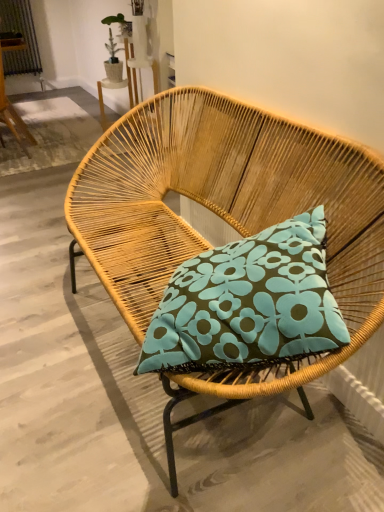
The height and width of the screenshot is (512, 384). What do you see at coordinates (12, 114) in the screenshot?
I see `rattan chair at upper left, which ranks as the 1th chair in back-to-front order` at bounding box center [12, 114].

Where is `rattan chair at upper left, which is the second chair from bottom to top`? Image resolution: width=384 pixels, height=512 pixels. rattan chair at upper left, which is the second chair from bottom to top is located at coordinates (12, 114).

In order to face rattan chair at upper left, which ranks as the second chair in front-to-back order, should I rotate leftwards or rightwards?

To align with it, rotate left about 25.851°.

Describe the element at coordinates (223, 220) in the screenshot. I see `woven wood chair at center, which is the 1th chair in right-to-left order` at that location.

Where is `woven wood chair at center, which is the 1th chair in right-to-left order`? The width and height of the screenshot is (384, 512). woven wood chair at center, which is the 1th chair in right-to-left order is located at coordinates (223, 220).

This screenshot has width=384, height=512. Identify the location of rattan chair at upper left, which is the second chair from bottom to top. (12, 114).

Visually, is rattan chair at upper left, marked as the first chair in a top-to-bottom arrangement, positioned to the left or to the right of woven wood chair at center, the second chair when ordered from back to front?

Based on their positions, rattan chair at upper left, marked as the first chair in a top-to-bottom arrangement, is located to the left of woven wood chair at center, the second chair when ordered from back to front.

Is rattan chair at upper left, which ranks as the 1th chair in back-to-front order, in front of or behind woven wood chair at center, positioned as the second chair in left-to-right order, in the image?

Visually, rattan chair at upper left, which ranks as the 1th chair in back-to-front order, is located behind woven wood chair at center, positioned as the second chair in left-to-right order.

Which is in front, point (20, 140) or point (138, 132)?

Positioned in front is point (138, 132).

From the image's perspective, is rattan chair at upper left, which ranks as the 1th chair in back-to-front order, on top of woven wood chair at center, placed as the 1th chair when sorted from bottom to top?

Yes, from the image's perspective, rattan chair at upper left, which ranks as the 1th chair in back-to-front order, is above woven wood chair at center, placed as the 1th chair when sorted from bottom to top.

From a real-world perspective, which is physically below, rattan chair at upper left, marked as the first chair in a top-to-bottom arrangement, or woven wood chair at center, the first chair when ordered from front to back?

woven wood chair at center, the first chair when ordered from front to back, from a real-world perspective.

Is rattan chair at upper left, marked as the first chair in a top-to-bottom arrangement, wider than woven wood chair at center, which is the 1th chair in right-to-left order?

No, rattan chair at upper left, marked as the first chair in a top-to-bottom arrangement, is not wider than woven wood chair at center, which is the 1th chair in right-to-left order.

Considering the sizes of rattan chair at upper left, arranged as the second chair when viewed from the right, and woven wood chair at center, placed as the 1th chair when sorted from bottom to top, in the image, is rattan chair at upper left, arranged as the second chair when viewed from the right, taller or shorter than woven wood chair at center, placed as the 1th chair when sorted from bottom to top,?

In the image, rattan chair at upper left, arranged as the second chair when viewed from the right, appears to be taller than woven wood chair at center, placed as the 1th chair when sorted from bottom to top.

Can you confirm if rattan chair at upper left, which ranks as the 1th chair in back-to-front order, is smaller than woven wood chair at center, which is the 1th chair in right-to-left order?

Yes.

Choose the correct answer: Is rattan chair at upper left, which is the second chair from bottom to top, inside woven wood chair at center, placed as the 1th chair when sorted from bottom to top, or outside it?

The correct answer is: outside.

Does rattan chair at upper left, arranged as the second chair when viewed from the right, touch woven wood chair at center, the second chair when ordered from back to front?

No, rattan chair at upper left, arranged as the second chair when viewed from the right, is not beside woven wood chair at center, the second chair when ordered from back to front.

Is rattan chair at upper left, marked as the first chair in a top-to-bottom arrangement, facing away from woven wood chair at center, which is the 1th chair in right-to-left order?

Yes, rattan chair at upper left, marked as the first chair in a top-to-bottom arrangement, is positioned with its back facing woven wood chair at center, which is the 1th chair in right-to-left order.

Where is `chair below the rattan chair at upper left, arranged as the second chair when viewed from the right (from a real-world perspective)`? chair below the rattan chair at upper left, arranged as the second chair when viewed from the right (from a real-world perspective) is located at coordinates (223, 220).

Based on their positions, is woven wood chair at center, the second chair when ordered from back to front, located to the left or right of rattan chair at upper left, which ranks as the 1th chair in back-to-front order?

Based on their positions, woven wood chair at center, the second chair when ordered from back to front, is located to the right of rattan chair at upper left, which ranks as the 1th chair in back-to-front order.

Which object is closer to the camera taking this photo, woven wood chair at center, which is the 1th chair in right-to-left order, or rattan chair at upper left, which ranks as the 1th chair in back-to-front order?

woven wood chair at center, which is the 1th chair in right-to-left order, is closer to the camera.

Does point (343, 308) come behind point (6, 110)?

No, it is in front of (6, 110).

From the image's perspective, does woven wood chair at center, positioned as the second chair in left-to-right order, appear lower than rattan chair at upper left, which ranks as the second chair in front-to-back order?

Yes, from the image's perspective, woven wood chair at center, positioned as the second chair in left-to-right order, is beneath rattan chair at upper left, which ranks as the second chair in front-to-back order.

From a real-world perspective, is woven wood chair at center, which is the 1th chair in right-to-left order, above or below rattan chair at upper left, marked as the first chair in a top-to-bottom arrangement?

woven wood chair at center, which is the 1th chair in right-to-left order, is situated lower than rattan chair at upper left, marked as the first chair in a top-to-bottom arrangement, in the real world.

Considering the sizes of woven wood chair at center, the first chair when ordered from front to back, and rattan chair at upper left, which ranks as the second chair in front-to-back order, in the image, is woven wood chair at center, the first chair when ordered from front to back, wider or thinner than rattan chair at upper left, which ranks as the second chair in front-to-back order,?

woven wood chair at center, the first chair when ordered from front to back, is wider than rattan chair at upper left, which ranks as the second chair in front-to-back order.

Which of these two, woven wood chair at center, placed as the 1th chair when sorted from bottom to top, or rattan chair at upper left, acting as the first chair starting from the left, stands taller?

rattan chair at upper left, acting as the first chair starting from the left.

Between woven wood chair at center, which ranks as the second chair in top-to-bottom order, and rattan chair at upper left, acting as the first chair starting from the left, which one has larger size?

Bigger between the two is woven wood chair at center, which ranks as the second chair in top-to-bottom order.

Is woven wood chair at center, the first chair when ordered from front to back, not inside rattan chair at upper left, acting as the first chair starting from the left?

That's correct, woven wood chair at center, the first chair when ordered from front to back, is outside of rattan chair at upper left, acting as the first chair starting from the left.

Is woven wood chair at center, the first chair when ordered from front to back, directly adjacent to rattan chair at upper left, acting as the first chair starting from the left?

No.

Is woven wood chair at center, placed as the 1th chair when sorted from bottom to top, oriented away from rattan chair at upper left, which ranks as the 1th chair in back-to-front order?

No, rattan chair at upper left, which ranks as the 1th chair in back-to-front order, is not at the back of woven wood chair at center, placed as the 1th chair when sorted from bottom to top.

How much distance is there between woven wood chair at center, placed as the 1th chair when sorted from bottom to top, and rattan chair at upper left, which ranks as the second chair in front-to-back order?

A distance of 6.95 feet exists between woven wood chair at center, placed as the 1th chair when sorted from bottom to top, and rattan chair at upper left, which ranks as the second chair in front-to-back order.

What are the coordinates of `chair below the rattan chair at upper left, which ranks as the 1th chair in back-to-front order (from a real-world perspective)` in the screenshot? It's located at click(223, 220).

At what (x,y) coordinates should I click in order to perform the action: click on chair that is below the rattan chair at upper left, which is the second chair from bottom to top (from the image's perspective). Please return your answer as a coordinate pair (x, y). Looking at the image, I should click on (223, 220).

Where is `chair lying on the right of rattan chair at upper left, which ranks as the second chair in front-to-back order`? chair lying on the right of rattan chair at upper left, which ranks as the second chair in front-to-back order is located at coordinates (223, 220).